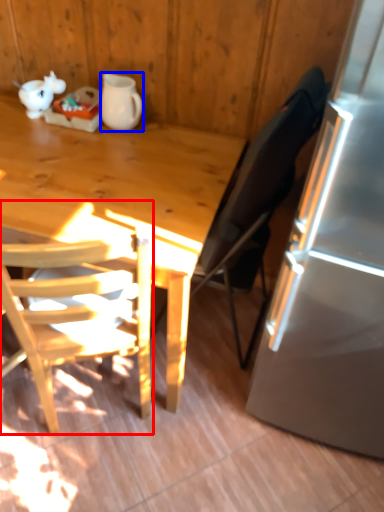
Question: Which of the following is the farthest to the observer, chair (highlighted by a red box) or pitcher (highlighted by a blue box)?

Choices:
 (A) chair
 (B) pitcher

Answer: (B)